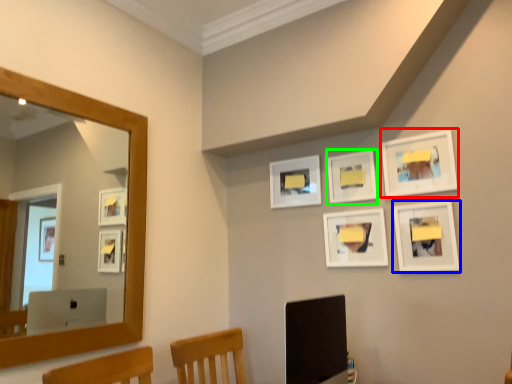
Question: Which is farther away from picture frame (highlighted by a red box)? picture frame (highlighted by a blue box) or picture frame (highlighted by a green box)?

Choices:
 (A) picture frame
 (B) picture frame

Answer: (B)